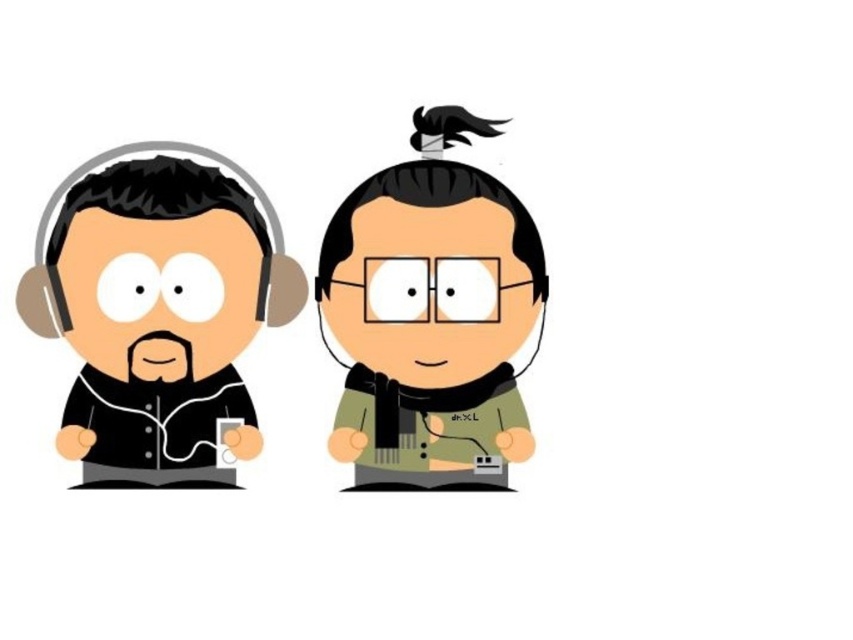
You are holding a measuring tape and need to determine if the distance from the point marked at coordinates point (114, 292) to your current position is within the 1 meter range required for your task. Can you confirm if this distance is under 1 meter?

The distance between point (114, 292) and the viewer is 78.86 centimeters, which is under 1 meter. Therefore, the distance is within the required range.

You are a photographer setting up a shoot with two props in front of you. You have the black matte headphones at left and the green matte scarf at center. Which prop is lower in position?

The black matte headphones at left are positioned under the green matte scarf at center, so the black matte headphones at left are lower.